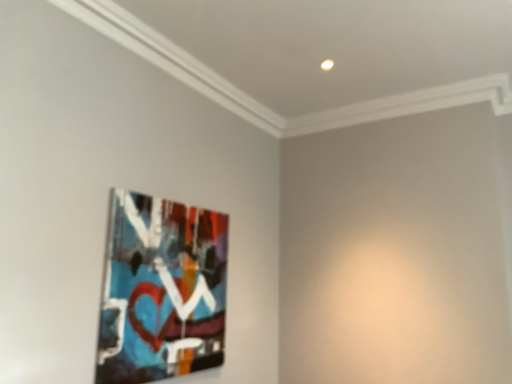
This screenshot has height=384, width=512. Identify the location of matte plastic picture frame at upper left. (161, 290).

What do you see at coordinates (161, 290) in the screenshot?
I see `matte plastic picture frame at upper left` at bounding box center [161, 290].

I want to click on matte plastic picture frame at upper left, so click(161, 290).